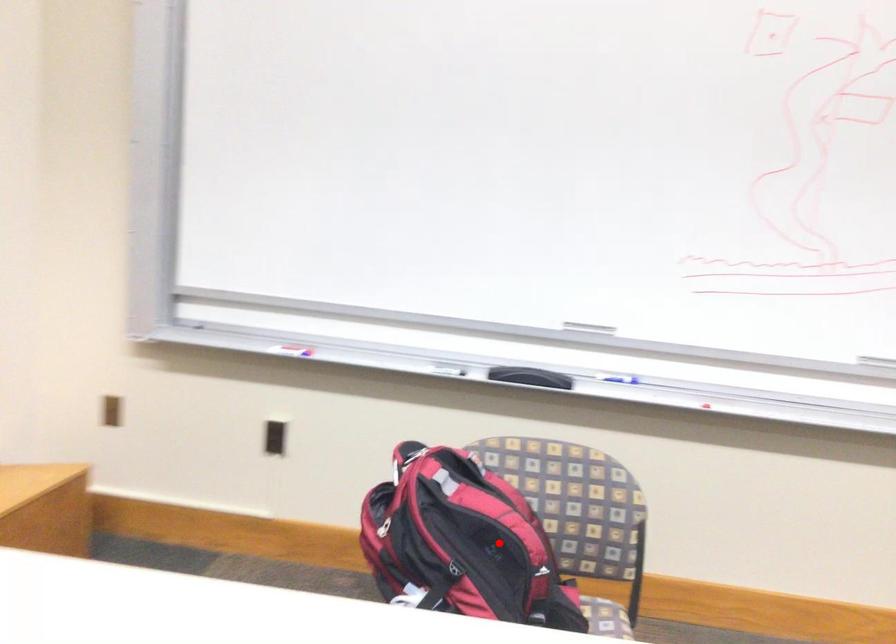
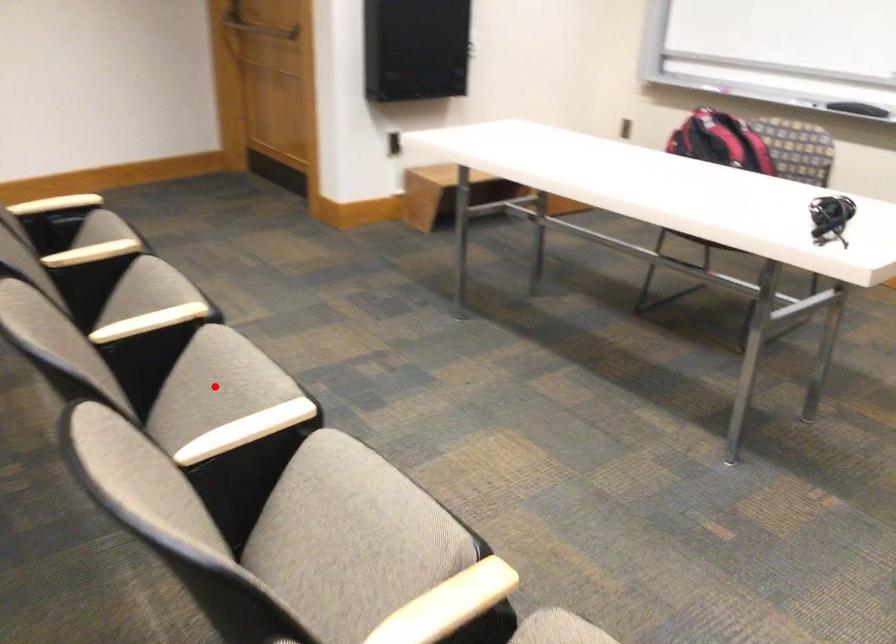
I am providing you with two images of the same scene from different viewpoints. A red point is marked on the first image and another point is marked on the second image. Is the marked point in image1 the same physical position as the marked point in image2?

No